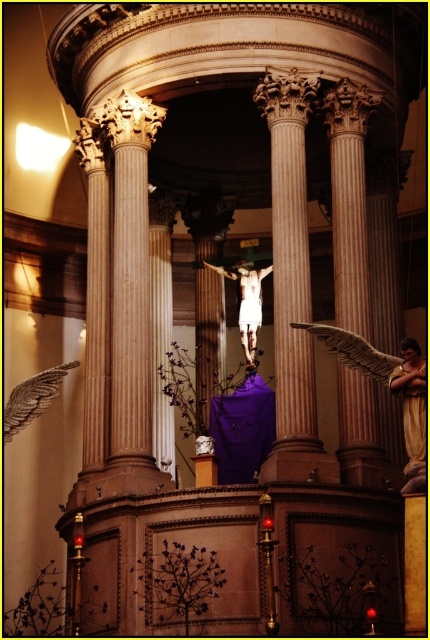
Question: Can you confirm if polished marble column at center is positioned to the right of white marble crucifix at center?

Choices:
 (A) no
 (B) yes

Answer: (B)

Question: Which point is farther from the camera taking this photo?

Choices:
 (A) (260, 312)
 (B) (301, 317)

Answer: (A)

Question: Is polished marble column at center in front of white marble crucifix at center?

Choices:
 (A) yes
 (B) no

Answer: (A)

Question: Which of the following is the closest to the observer?

Choices:
 (A) white marble crucifix at center
 (B) polished marble column at center

Answer: (B)

Question: Which point is closer to the camera taking this photo?

Choices:
 (A) pyautogui.click(x=240, y=326)
 (B) pyautogui.click(x=276, y=449)

Answer: (B)

Question: Is polished marble column at center positioned behind white marble crucifix at center?

Choices:
 (A) no
 (B) yes

Answer: (A)